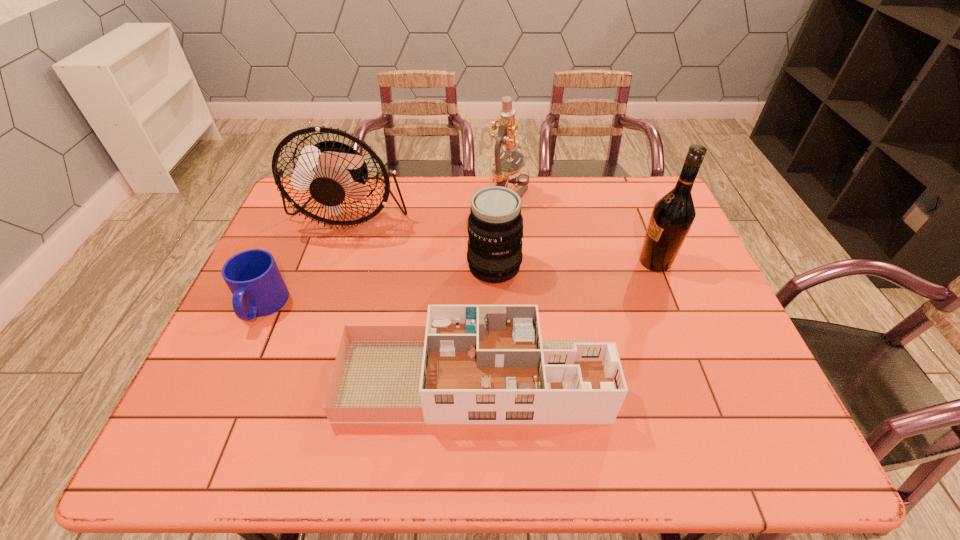
Where is `object that is at the far left corner`? object that is at the far left corner is located at coordinates coord(330,170).

Locate an element on the screen. free space at the far edge is located at coordinates (456, 178).

Where is `free space at the near edge of the desktop`? The image size is (960, 540). free space at the near edge of the desktop is located at coordinates (526, 450).

Locate an element on the screen. The height and width of the screenshot is (540, 960). free region at the left edge of the desktop is located at coordinates (230, 330).

In the image, there is a desktop. At what (x,y) coordinates should I click in order to perform the action: click on free region at the right edge. Please return your answer as a coordinate pair (x, y). The image size is (960, 540). Looking at the image, I should click on (x=673, y=296).

What are the coordinates of `free spot at the near left corner of the desktop` in the screenshot? It's located at [x=220, y=434].

This screenshot has width=960, height=540. What are the coordinates of `vacant space at the far right corner` in the screenshot? It's located at (621, 176).

The image size is (960, 540). What are the coordinates of `free space between the mug and the microscope` in the screenshot? It's located at tap(386, 251).

Identify the location of vacant region between the wine bottle and the nearest object. (564, 321).

What are the coordinates of `empty location between the fan and the microscope` in the screenshot? It's located at (430, 204).